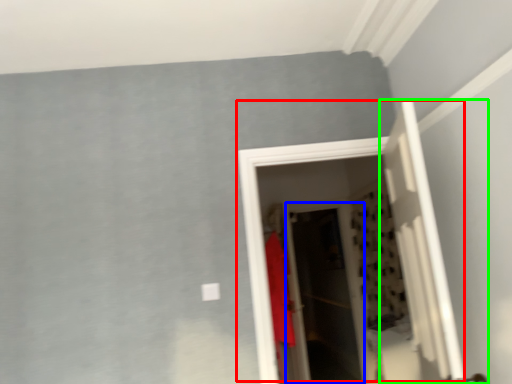
Question: Which object is the closest to the door (highlighted by a red box)? Choose among these: screen door (highlighted by a blue box) or door (highlighted by a green box).

Choices:
 (A) screen door
 (B) door

Answer: (B)